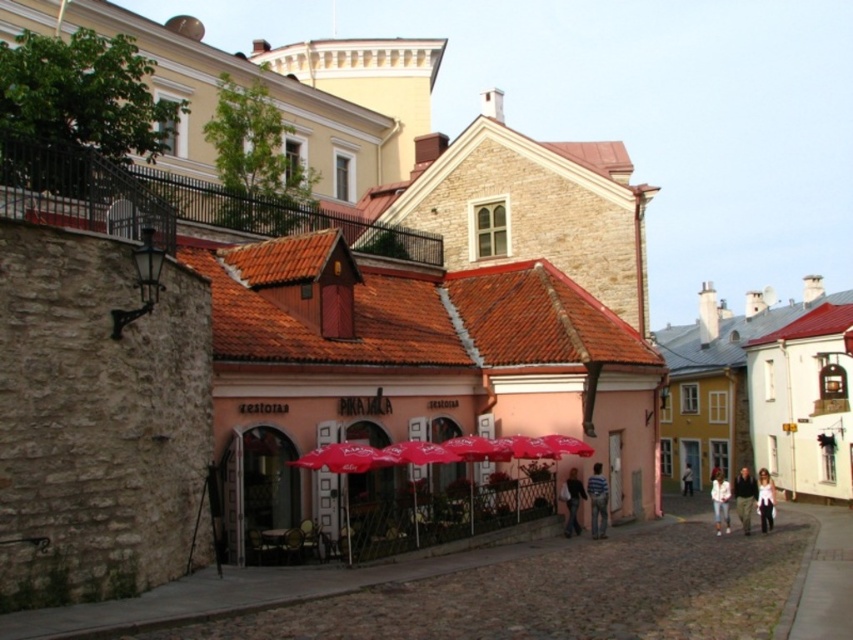
Question: Which point appears farthest from the camera in this image?

Choices:
 (A) (355, 468)
 (B) (592, 538)
 (C) (570, 490)
 (D) (737, 496)

Answer: (D)

Question: Is striped fabric shirt at center closer to camera compared to light pink fabric coat at lower right?

Choices:
 (A) no
 (B) yes

Answer: (B)

Question: Which point is farther to the camera?

Choices:
 (A) red fabric umbrella at center
 (B) pink matte building at center
 (C) white cotton shirt at center

Answer: (C)

Question: Is dark gray fabric jacket at center below white cotton shirt at center?

Choices:
 (A) no
 (B) yes

Answer: (A)

Question: Does pink matte building at center have a larger size compared to cobblestone pavement at center?

Choices:
 (A) no
 (B) yes

Answer: (B)

Question: Among these objects, which one is farthest from the camera?

Choices:
 (A) white matte jacket at lower right
 (B) dark gray fabric jacket at center
 (C) cobblestone pavement at center
 (D) dark blue jeans at center

Answer: (B)